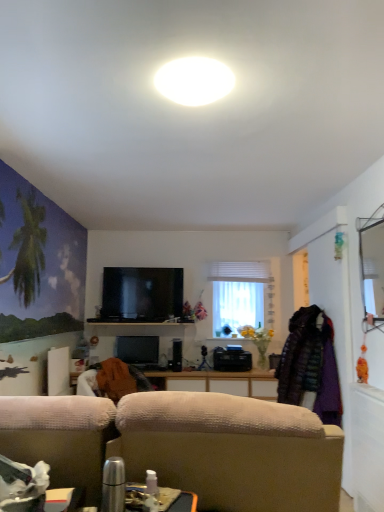
What do you see at coordinates (138, 350) in the screenshot?
I see `black glossy television at center, which is counted as the first television, starting from the bottom` at bounding box center [138, 350].

Image resolution: width=384 pixels, height=512 pixels. What do you see at coordinates (141, 294) in the screenshot?
I see `black glossy flat-screen tv at center, which appears as the second television when ordered from the bottom` at bounding box center [141, 294].

Image resolution: width=384 pixels, height=512 pixels. What do you see at coordinates (242, 296) in the screenshot?
I see `white sheer curtain at center` at bounding box center [242, 296].

Locate an element on the screen. This screenshot has height=512, width=384. white glossy ceiling light at upper center is located at coordinates (194, 81).

Looking at this image, between white sheer curtain at center and black glossy flat-screen tv at center, the first television viewed from the top, which one has larger width?

white sheer curtain at center is wider.

Is white sheer curtain at center bigger than black glossy flat-screen tv at center, which appears as the second television when ordered from the bottom?

No.

Can you confirm if white sheer curtain at center is taller than black glossy flat-screen tv at center, the first television viewed from the top?

Correct, white sheer curtain at center is much taller as black glossy flat-screen tv at center, the first television viewed from the top.

Is the surface of black glossy television at center, the second television positioned from the top, in direct contact with white sheer curtain at center?

They are not placed beside each other.

Consider the image. Could you measure the distance between black glossy television at center, the second television positioned from the top, and white sheer curtain at center?

The distance of black glossy television at center, the second television positioned from the top, from white sheer curtain at center is 1.07 meters.

Is point (139, 362) closer or farther from the camera than point (233, 318)?

Point (139, 362) is closer to the camera than point (233, 318).

Does black glossy television at center, the second television positioned from the top, lie behind white sheer curtain at center?

No.

Based on the photo, is black glossy television at center, the second television positioned from the top, aimed at white glossy ceiling light at upper center?

No, black glossy television at center, the second television positioned from the top, is not turned towards white glossy ceiling light at upper center.

Considering the sizes of black glossy television at center, which is counted as the first television, starting from the bottom, and white glossy ceiling light at upper center in the image, is black glossy television at center, which is counted as the first television, starting from the bottom, wider or thinner than white glossy ceiling light at upper center?

Clearly, black glossy television at center, which is counted as the first television, starting from the bottom, has less width compared to white glossy ceiling light at upper center.

In order to click on television that is the 2nd one below the white glossy ceiling light at upper center (from a real-world perspective) in this screenshot , I will do `click(138, 350)`.

Is black glossy flat-screen tv at center, the first television viewed from the top, smaller than white glossy ceiling light at upper center?

Actually, black glossy flat-screen tv at center, the first television viewed from the top, might be larger than white glossy ceiling light at upper center.

In the scene shown: Which of these two, black glossy flat-screen tv at center, which appears as the second television when ordered from the bottom, or white glossy ceiling light at upper center, stands shorter?

With less height is white glossy ceiling light at upper center.

Measure the distance between black glossy flat-screen tv at center, the first television viewed from the top, and white glossy ceiling light at upper center.

A distance of 10.27 feet exists between black glossy flat-screen tv at center, the first television viewed from the top, and white glossy ceiling light at upper center.

Is black glossy flat-screen tv at center, the first television viewed from the top, wider or thinner than white glossy ceiling light at upper center?

Clearly, black glossy flat-screen tv at center, the first television viewed from the top, has less width compared to white glossy ceiling light at upper center.

What are the coordinates of `television located below the black glossy flat-screen tv at center, which appears as the second television when ordered from the bottom (from the image's perspective)` in the screenshot? It's located at (138, 350).

Which of these two, black glossy television at center, which is counted as the first television, starting from the bottom, or black glossy flat-screen tv at center, the first television viewed from the top, stands shorter?

black glossy television at center, which is counted as the first television, starting from the bottom.

Is black glossy television at center, which is counted as the first television, starting from the bottom, not near black glossy flat-screen tv at center, the first television viewed from the top?

That's not correct — black glossy television at center, which is counted as the first television, starting from the bottom, is a little close to black glossy flat-screen tv at center, the first television viewed from the top.

Is point (134, 353) closer or farther from the camera than point (166, 275)?

Point (134, 353) appears to be closer to the viewer than point (166, 275).

Which object is positioned more to the right, white glossy ceiling light at upper center or white sheer curtain at center?

Positioned to the right is white sheer curtain at center.

From a real-world perspective, is white glossy ceiling light at upper center located beneath white sheer curtain at center?

Actually, white glossy ceiling light at upper center is physically above white sheer curtain at center in the real world.

From the image's perspective, is white glossy ceiling light at upper center located beneath white sheer curtain at center?

Incorrect, from the image's perspective, white glossy ceiling light at upper center is higher than white sheer curtain at center.

Which of these two, white glossy ceiling light at upper center or white sheer curtain at center, stands taller?

white sheer curtain at center.

In the scene shown: Is white sheer curtain at center not within black glossy television at center, the second television positioned from the top?

white sheer curtain at center lies outside black glossy television at center, the second television positioned from the top,'s area.

In the image, is white sheer curtain at center on the left side or the right side of black glossy television at center, the second television positioned from the top?

white sheer curtain at center is positioned on black glossy television at center, the second television positioned from the top,'s right side.

Is white sheer curtain at center facing away from black glossy television at center, which is counted as the first television, starting from the bottom?

That's not correct — white sheer curtain at center is not looking away from black glossy television at center, which is counted as the first television, starting from the bottom.

From their relative heights in the image, would you say white sheer curtain at center is taller or shorter than black glossy television at center, which is counted as the first television, starting from the bottom?

Considering their sizes, white sheer curtain at center has more height than black glossy television at center, which is counted as the first television, starting from the bottom.

The width and height of the screenshot is (384, 512). What are the coordinates of `window located above the black glossy flat-screen tv at center, the first television viewed from the top (from a real-world perspective)` in the screenshot? It's located at (242, 296).

Locate an element on the screen. The image size is (384, 512). the 2nd television directly beneath the white sheer curtain at center (from a real-world perspective) is located at coordinates (138, 350).

Considering their positions, is white glossy ceiling light at upper center positioned further to black glossy flat-screen tv at center, which appears as the second television when ordered from the bottom, than black glossy television at center, the second television positioned from the top?

white glossy ceiling light at upper center is further to black glossy flat-screen tv at center, which appears as the second television when ordered from the bottom.

Based on their spatial positions, is black glossy flat-screen tv at center, which appears as the second television when ordered from the bottom, or white glossy ceiling light at upper center further from black glossy television at center, the second television positioned from the top?

white glossy ceiling light at upper center.

Which object lies nearer to the anchor point white sheer curtain at center, black glossy television at center, the second television positioned from the top, or white glossy ceiling light at upper center?

Among the two, black glossy television at center, the second television positioned from the top, is located nearer to white sheer curtain at center.

Considering their positions, is white glossy ceiling light at upper center positioned further to white sheer curtain at center than black glossy television at center, the second television positioned from the top?

The object further to white sheer curtain at center is white glossy ceiling light at upper center.

From the image, which object appears to be nearer to white sheer curtain at center, white glossy ceiling light at upper center or black glossy flat-screen tv at center, the first television viewed from the top?

black glossy flat-screen tv at center, the first television viewed from the top, is positioned closer to the anchor white sheer curtain at center.

Looking at the image, which one is located further to white sheer curtain at center, black glossy television at center, the second television positioned from the top, or black glossy flat-screen tv at center, the first television viewed from the top?

Based on the image, black glossy television at center, the second television positioned from the top, appears to be further to white sheer curtain at center.

Which object lies nearer to the anchor point white glossy ceiling light at upper center, white sheer curtain at center or black glossy flat-screen tv at center, which appears as the second television when ordered from the bottom?

The object closer to white glossy ceiling light at upper center is black glossy flat-screen tv at center, which appears as the second television when ordered from the bottom.

From the image, which object appears to be nearer to black glossy television at center, which is counted as the first television, starting from the bottom, white glossy ceiling light at upper center or white sheer curtain at center?

Based on the image, white sheer curtain at center appears to be nearer to black glossy television at center, which is counted as the first television, starting from the bottom.

At what (x,y) coordinates should I click in order to perform the action: click on television between black glossy television at center, which is counted as the first television, starting from the bottom, and white sheer curtain at center from left to right. Please return your answer as a coordinate pair (x, y). Looking at the image, I should click on (141, 294).

Locate an element on the screen. television between white glossy ceiling light at upper center and black glossy flat-screen tv at center, which appears as the second television when ordered from the bottom, in the front-back direction is located at coordinates (138, 350).